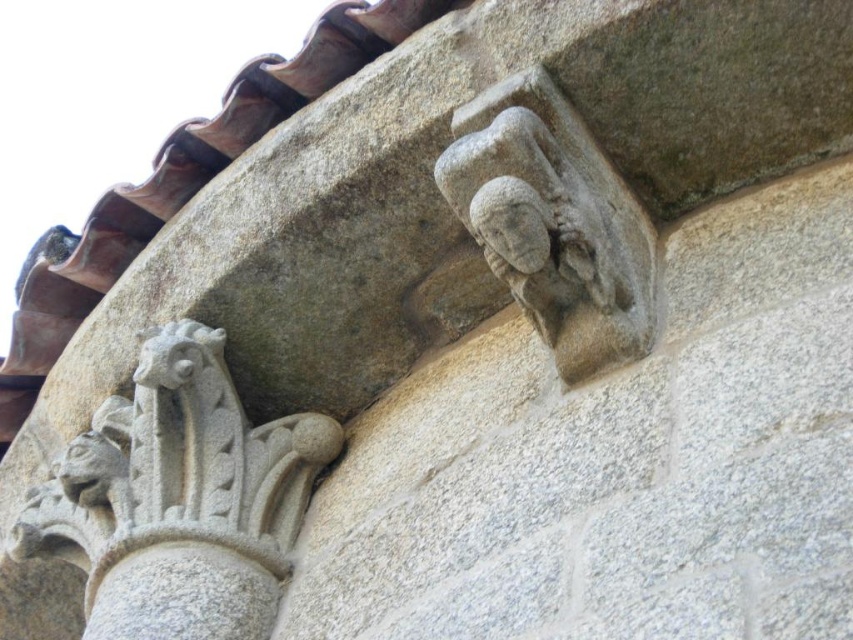
You are an architect examining the stone carvings on the wall. You notice the gray stone sculpture at lower left and the gray stone head at upper right. Which one has a larger size?

The gray stone sculpture at lower left is bigger than the gray stone head at upper right, so the gray stone sculpture at lower left has a larger size.

You are an architect analyzing the stone structure. You need to locate the gray stone sculpture at lower left. What are its coordinates?

The gray stone sculpture at lower left is located at coordinates point (x=178, y=499).

You are standing in front of the stone structure and want to touch the point at coordinates point (x=190, y=608). Given that you can reach up to 100 feet, will you be able to reach it?

The point (x=190, y=608) is 120.74 feet away from the camera, which is beyond your reach of 100 feet. Therefore, you cannot reach it.